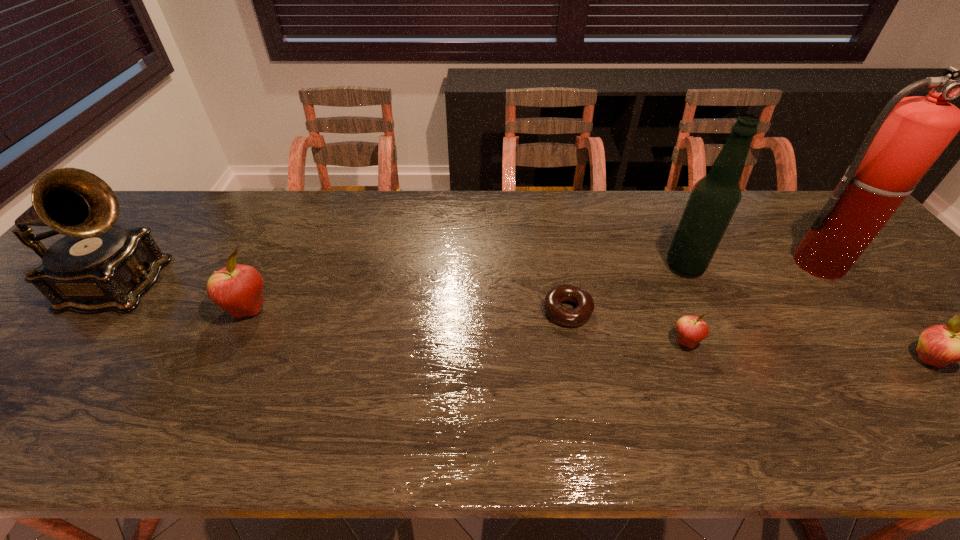
Identify the location of free space located on the back of the leftmost apple. (269, 267).

Where is `free space located on the back of the second apple from left to right`? This screenshot has height=540, width=960. free space located on the back of the second apple from left to right is located at coordinates (663, 287).

I want to click on blank area located on the right of the alcohol, so click(x=753, y=266).

I want to click on vacant space situated 0.130m with the nozzle and gauge on the fire extinguisher, so click(x=866, y=319).

Identify the location of free location located on the horn of the phonograph record. (215, 286).

Where is `vacant space positioned 0.120m on the back of the shortest object`? vacant space positioned 0.120m on the back of the shortest object is located at coordinates (559, 261).

Where is `object present at the left edge`? object present at the left edge is located at coordinates (97, 266).

Locate an element on the screen. object at the right edge is located at coordinates (910, 133).

Find the location of a particular element. vacant area at the far edge of the desktop is located at coordinates (783, 230).

The image size is (960, 540). In the image, there is a desktop. What are the coordinates of `vacant space at the near edge` in the screenshot? It's located at click(484, 403).